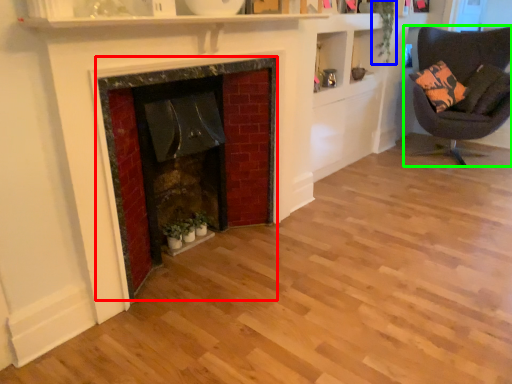
Question: Which is nearer to the fireplace (highlighted by a red box)? plant (highlighted by a blue box) or chair (highlighted by a green box).

Choices:
 (A) plant
 (B) chair

Answer: (A)